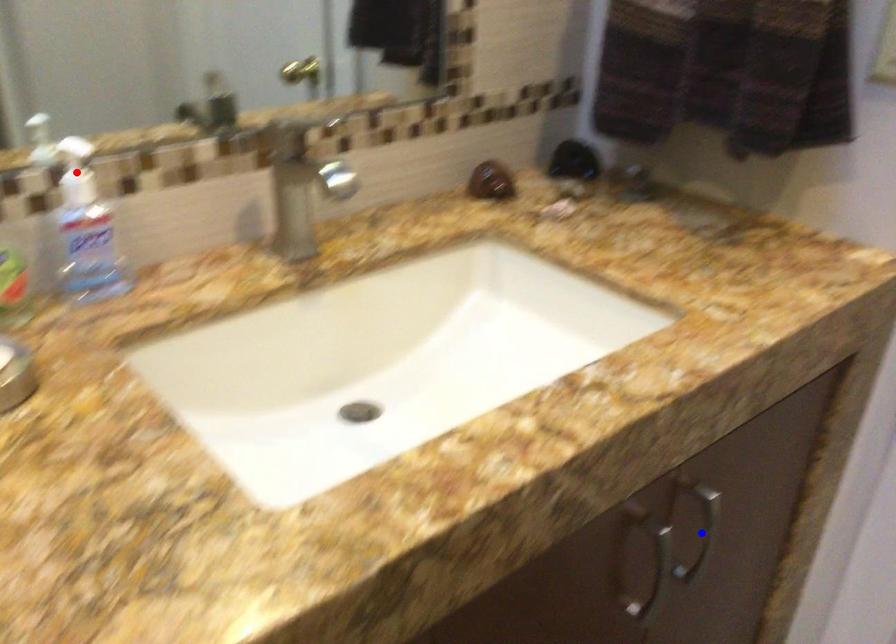
Question: Two points are marked on the image. Which point is closer to the camera?

Choices:
 (A) Blue point is closer.
 (B) Red point is closer.

Answer: (B)